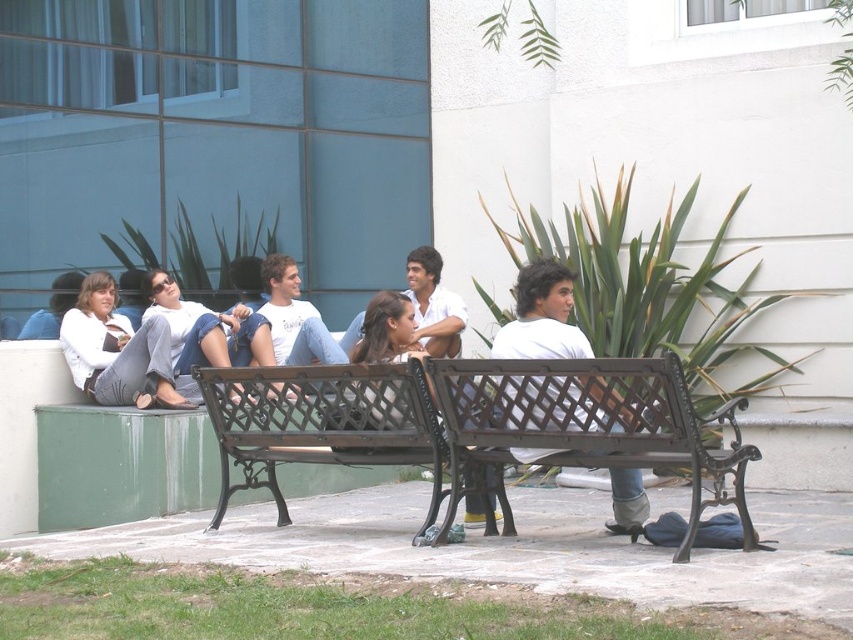
Which is more to the right, matte white shirt at left or white matte shirt at center?

white matte shirt at center is more to the right.

Identify the location of matte white shirt at left. The height and width of the screenshot is (640, 853). (117, 352).

Which is in front, point (85, 362) or point (566, 296)?

Point (566, 296) is more forward.

You are a GUI agent. You are given a task and a screenshot of the screen. Output one action in this format:
    pyautogui.click(x=<x>, y=<y>)
    Task: Click on the matte white shirt at left
    
    Given the screenshot: What is the action you would take?
    pyautogui.click(x=117, y=352)

Can you confirm if dark brown wood bench at center is wider than white matte shirt at center?

Correct, the width of dark brown wood bench at center exceeds that of white matte shirt at center.

The width and height of the screenshot is (853, 640). I want to click on dark brown wood bench at center, so click(x=589, y=422).

Find the location of `dark brown wood bench at center`. dark brown wood bench at center is located at coordinates (589, 422).

Is dark brown wood bench at center above matte white shirt at left?

No, dark brown wood bench at center is not above matte white shirt at left.

Does dark brown wood bench at center appear on the right side of matte white shirt at left?

Yes, dark brown wood bench at center is to the right of matte white shirt at left.

Image resolution: width=853 pixels, height=640 pixels. I want to click on dark brown wood bench at center, so click(589, 422).

Where is `dark brown wood bench at center`? dark brown wood bench at center is located at coordinates (589, 422).